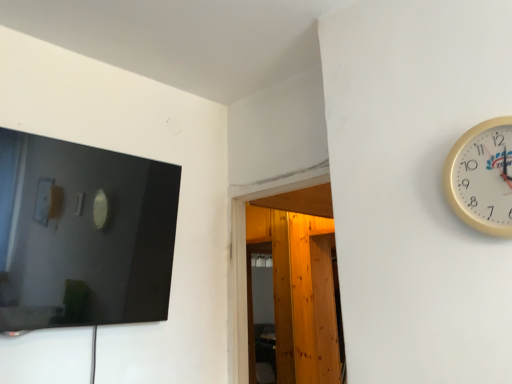
Locate an element on the screen. The width and height of the screenshot is (512, 384). white plastic wall clock at right is located at coordinates coord(482,177).

Describe the element at coordinates (482, 177) in the screenshot. Image resolution: width=512 pixels, height=384 pixels. I see `white plastic wall clock at right` at that location.

In order to face white plastic wall clock at right, should I rotate leftwards or rightwards?

You should rotate right by 30.488 degrees.

At what (x,y) coordinates should I click in order to perform the action: click on transparent wooden door at center. Please return your answer as a coordinate pair (x, y). The height and width of the screenshot is (384, 512). Looking at the image, I should click on pyautogui.click(x=300, y=293).

The image size is (512, 384). What do you see at coordinates (300, 293) in the screenshot?
I see `transparent wooden door at center` at bounding box center [300, 293].

At what (x,y) coordinates should I click in order to perform the action: click on white plastic wall clock at right. Please return your answer as a coordinate pair (x, y). The height and width of the screenshot is (384, 512). Looking at the image, I should click on (482, 177).

Can you confirm if white plastic wall clock at right is positioned to the right of transparent wooden door at center?

Yes.

Relative to transparent wooden door at center, is white plastic wall clock at right in front or behind?

white plastic wall clock at right is positioned closer to the viewer than transparent wooden door at center.

Which is behind, point (504, 149) or point (252, 367)?

The point (252, 367) is farther from the camera.

From the image's perspective, is white plastic wall clock at right above or below transparent wooden door at center?

From the image's perspective, white plastic wall clock at right appears above transparent wooden door at center.

From a real-world perspective, is white plastic wall clock at right positioned over transparent wooden door at center based on gravity?

Yes.

Between white plastic wall clock at right and transparent wooden door at center, which one has smaller width?

white plastic wall clock at right is thinner.

In terms of height, does white plastic wall clock at right look taller or shorter compared to transparent wooden door at center?

Considering their sizes, white plastic wall clock at right has less height than transparent wooden door at center.

Looking at this image, who is smaller, white plastic wall clock at right or transparent wooden door at center?

white plastic wall clock at right is smaller.

Is transparent wooden door at center inside white plastic wall clock at right?

No, transparent wooden door at center is located outside of white plastic wall clock at right.

Are white plastic wall clock at right and transparent wooden door at center far apart?

Yes, white plastic wall clock at right and transparent wooden door at center are located far from each other.

In the scene shown: Is white plastic wall clock at right oriented towards transparent wooden door at center?

No, white plastic wall clock at right is not oriented towards transparent wooden door at center.

Locate an element on the screen. Image resolution: width=512 pixels, height=384 pixels. wall clock in front of the transparent wooden door at center is located at coordinates tap(482, 177).

Can you confirm if transparent wooden door at center is positioned to the right of white plastic wall clock at right?

No, transparent wooden door at center is not to the right of white plastic wall clock at right.

Between transparent wooden door at center and white plastic wall clock at right, which one is positioned in front?

white plastic wall clock at right is closer to the camera.

Looking at this image, which is further, (x=291, y=291) or (x=488, y=231)?

The point (x=291, y=291) is farther from the camera.

From the image's perspective, does transparent wooden door at center appear higher than white plastic wall clock at right?

No, from the image's perspective, transparent wooden door at center is not above white plastic wall clock at right.

From a real-world perspective, who is located higher, transparent wooden door at center or white plastic wall clock at right?

white plastic wall clock at right is physically above.

In terms of width, does transparent wooden door at center look wider or thinner when compared to white plastic wall clock at right?

In the image, transparent wooden door at center appears to be wider than white plastic wall clock at right.

Between transparent wooden door at center and white plastic wall clock at right, which one has more height?

transparent wooden door at center is taller.

Which of these two, transparent wooden door at center or white plastic wall clock at right, is bigger?

With larger size is transparent wooden door at center.

Is transparent wooden door at center situated inside white plastic wall clock at right or outside?

The correct answer is: outside.

Can you see transparent wooden door at center touching white plastic wall clock at right?

No, transparent wooden door at center is not with white plastic wall clock at right.

Is transparent wooden door at center looking in the opposite direction of white plastic wall clock at right?

transparent wooden door at center is not turned away from white plastic wall clock at right.

Can you tell me how much transparent wooden door at center and white plastic wall clock at right differ in facing direction?

0.0128 degrees.

The image size is (512, 384). Identify the location of glass door located behind the white plastic wall clock at right. (300, 293).

Find the location of a particular element. This screenshot has height=384, width=512. glass door behind the white plastic wall clock at right is located at coordinates (300, 293).

The image size is (512, 384). I want to click on wall clock in front of the transparent wooden door at center, so click(x=482, y=177).